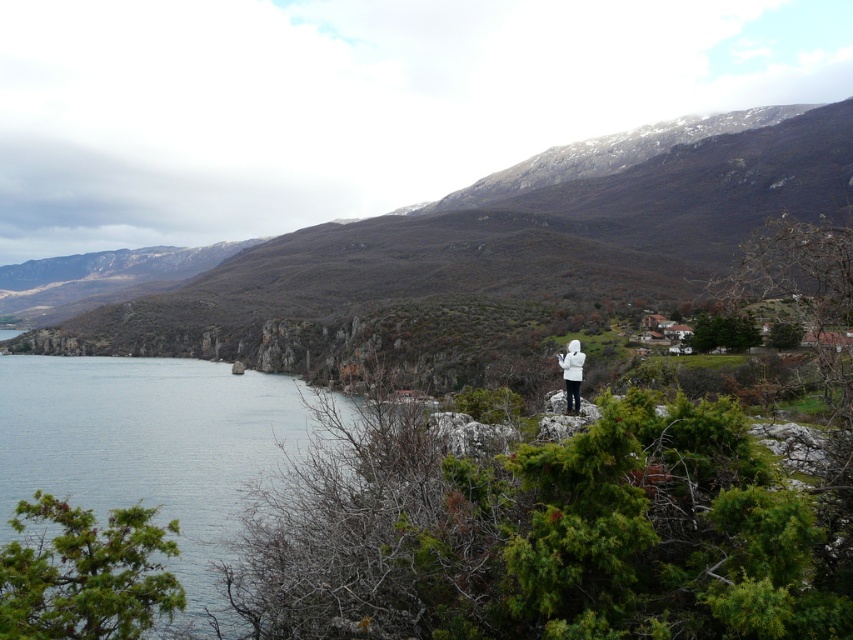
You are planning to take a photo of the rocky brown mountain at center and the blue water at lower left. Which object should you focus on first if you want to capture both in a single frame without moving the camera?

You should focus on the rocky brown mountain at center first because it is larger in size than the blue water at lower left, making it the dominant subject in the frame.